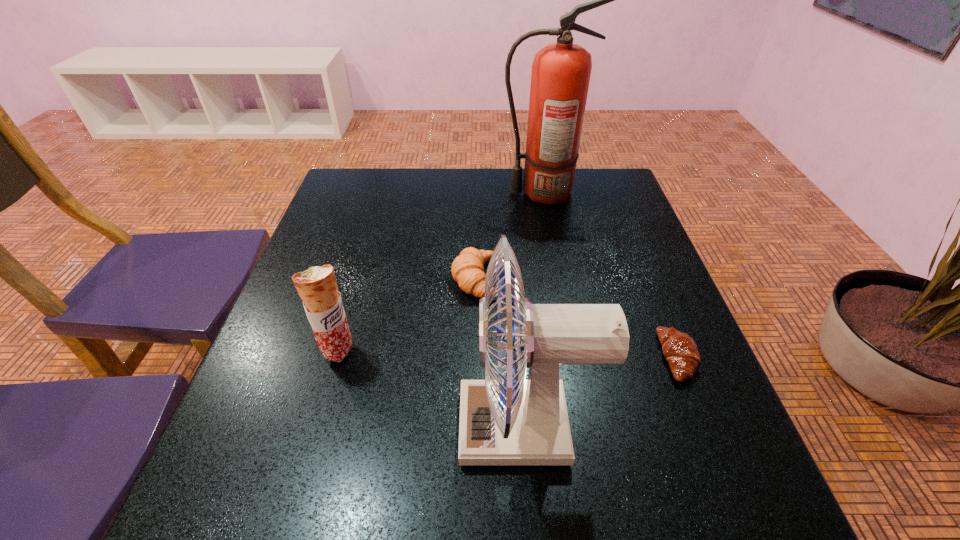
Locate an element on the screen. The width and height of the screenshot is (960, 540). object that is at the left edge is located at coordinates (317, 287).

Locate an element on the screen. fire extinguisher that is at the right edge is located at coordinates click(561, 71).

Where is `crescent roll located at the right edge`? This screenshot has width=960, height=540. crescent roll located at the right edge is located at coordinates (679, 349).

What are the coordinates of `object located at the far right corner` in the screenshot? It's located at (561, 71).

Image resolution: width=960 pixels, height=540 pixels. In the image, there is a desktop. Identify the location of free region at the far edge. (407, 202).

You are a GUI agent. You are given a task and a screenshot of the screen. Output one action in this format:
    pyautogui.click(x=<x>, y=<y>)
    Task: Click on the vacant space at the left edge of the desktop
    
    Given the screenshot: What is the action you would take?
    point(309,391)

At what (x,y) coordinates should I click in order to perform the action: click on free spot at the right edge of the desktop. Please return your answer as a coordinate pair (x, y). Looking at the image, I should click on (656, 450).

Locate an element on the screen. The width and height of the screenshot is (960, 540). free space at the far left corner is located at coordinates (352, 206).

Locate an element on the screen. This screenshot has width=960, height=540. vacant area at the far right corner is located at coordinates (603, 190).

Where is `free spot at the near right corner of the desktop`? This screenshot has width=960, height=540. free spot at the near right corner of the desktop is located at coordinates (666, 489).